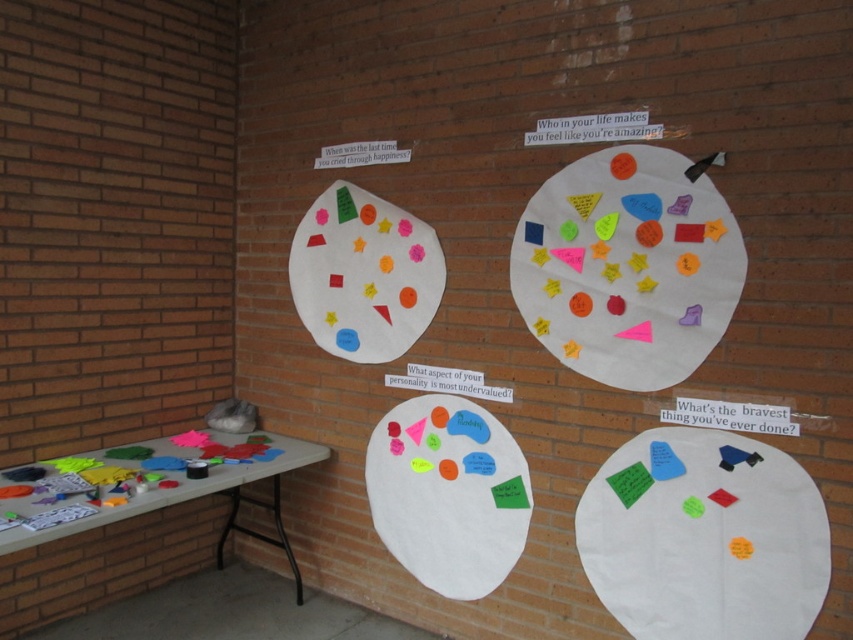
Is point (21, 536) in front of point (444, 573)?

Yes.

Locate an element on the screen. Image resolution: width=853 pixels, height=640 pixels. smooth gray table at lower left is located at coordinates (131, 541).

Can you confirm if white matte paper plate at lower right is positioned to the right of multicolored felt shapes at center?

Indeed, white matte paper plate at lower right is positioned on the right side of multicolored felt shapes at center.

Is white matte paper plate at lower right below multicolored felt shapes at center?

Yes.

Who is more forward, (820, 564) or (721, 248)?

Point (820, 564)

This screenshot has height=640, width=853. I want to click on white matte paper plate at lower right, so click(x=704, y=538).

Who is positioned more to the right, white matte paper plate at lower right or smooth gray table at lower left?

white matte paper plate at lower right is more to the right.

Can you confirm if white matte paper plate at lower right is positioned to the left of smooth gray table at lower left?

Incorrect, white matte paper plate at lower right is not on the left side of smooth gray table at lower left.

Is point (733, 600) positioned behind point (120, 577)?

No, it is in front of (120, 577).

At what (x,y) coordinates should I click in order to perform the action: click on white matte paper plate at lower right. Please return your answer as a coordinate pair (x, y). Looking at the image, I should click on (704, 538).